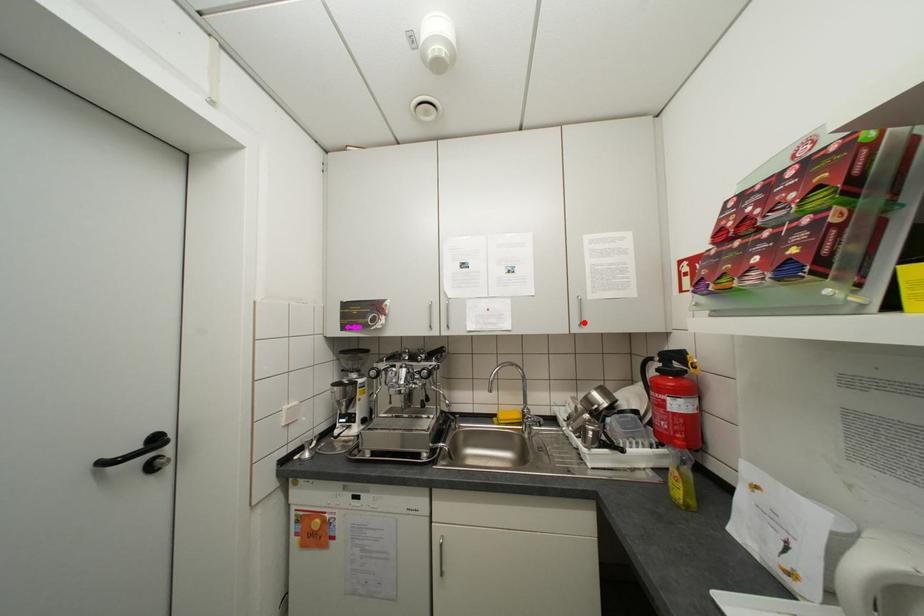
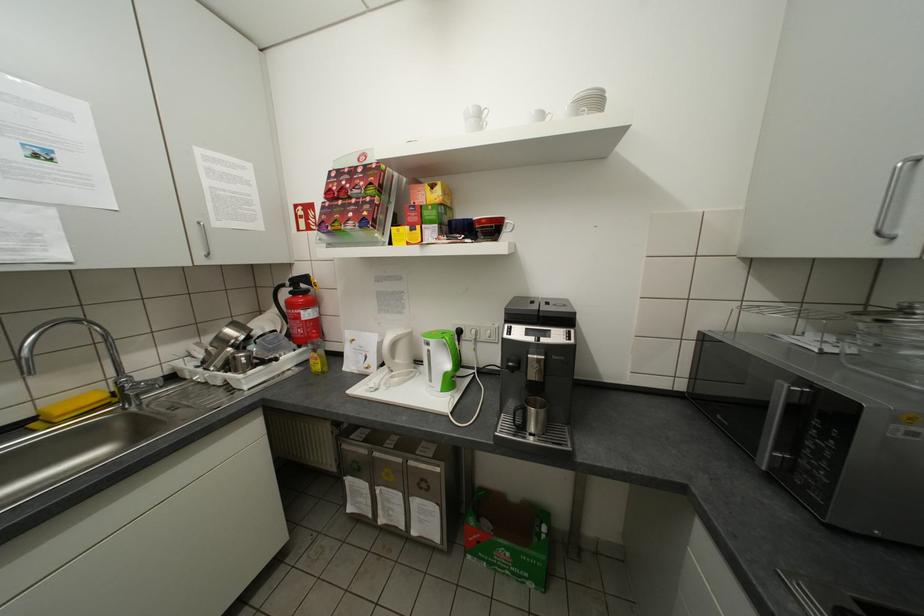
Where in the second image is the point corresponding to the highlighted location from the first image?

(209, 253)